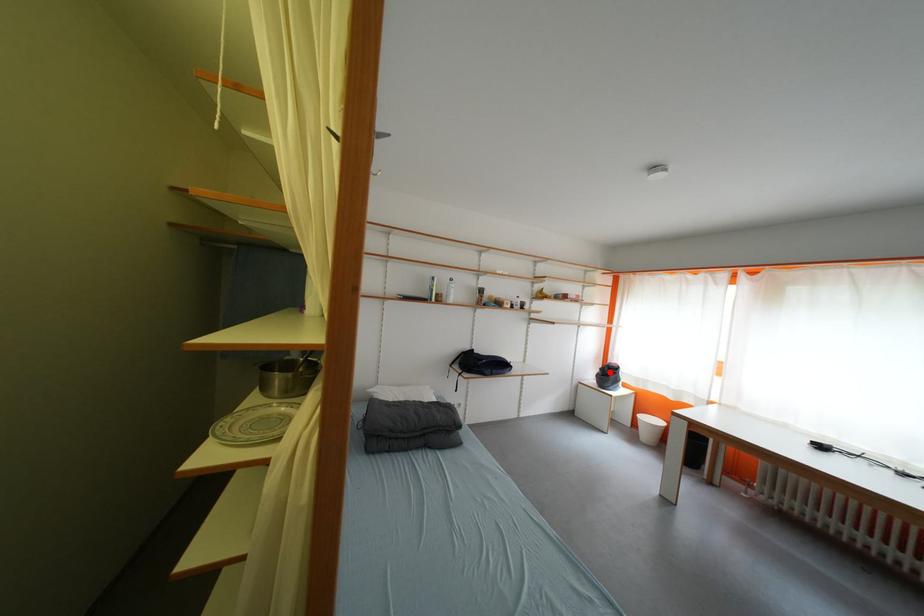
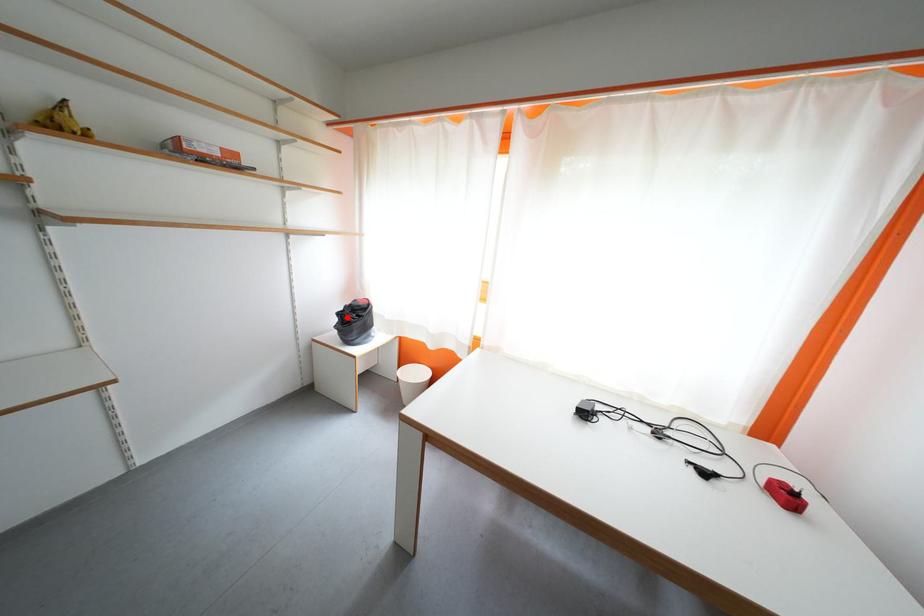
I am providing you with two images of the same scene from different viewpoints. A red point is marked on the first image and another point is marked on the second image. Does the point marked in image1 correspond to the same location as the one in image2?

Yes